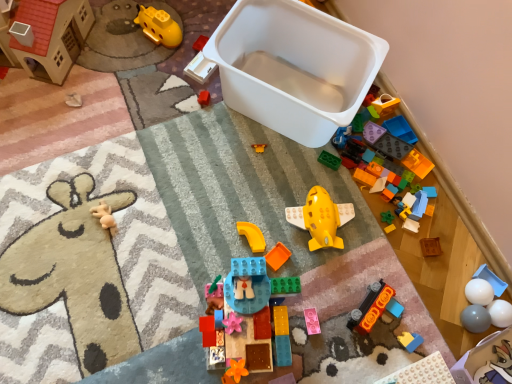
This screenshot has width=512, height=384. I want to click on vacant space that is in between matte plastic toy at lower right, the 5th toy viewed from the right, and white plastic storage box at upper center, the 2th storage box in the right-to-left sequence, so click(x=348, y=210).